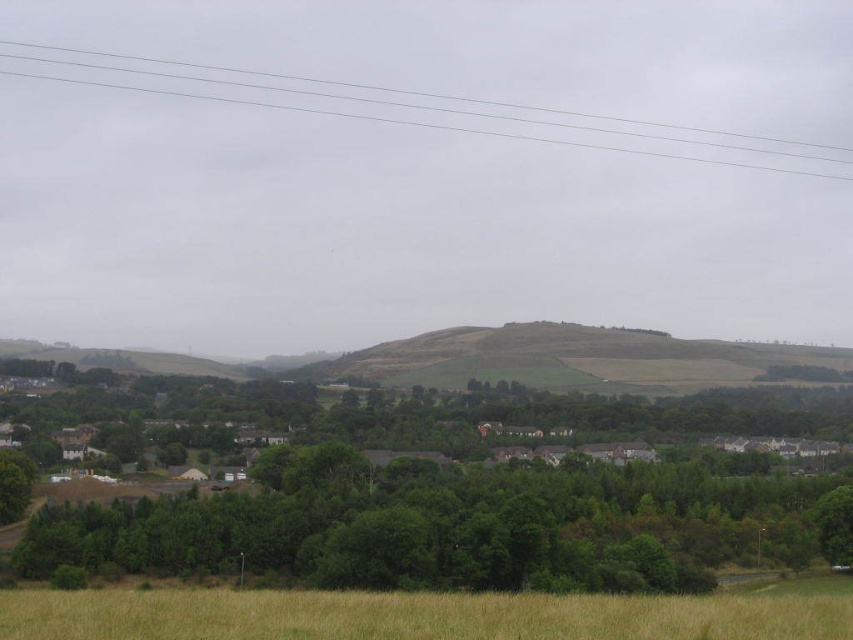
Between green leafy tree at lower center and clear plastic power lines at upper center, which one appears on the right side from the viewer's perspective?

Positioned to the right is green leafy tree at lower center.

Is green leafy tree at lower center to the right of clear plastic power lines at upper center from the viewer's perspective?

Correct, you'll find green leafy tree at lower center to the right of clear plastic power lines at upper center.

Which is in front, point (633, 490) or point (622, 122)?

Point (633, 490) is in front.

Find the location of `green leafy tree at lower center`. green leafy tree at lower center is located at coordinates (453, 529).

Is green leafy tree at lower center smaller than brown grassy field at lower center?

Actually, green leafy tree at lower center might be larger than brown grassy field at lower center.

Looking at this image, is green leafy tree at lower center shorter than brown grassy field at lower center?

No.

Between point (126, 566) and point (496, 616), which one is positioned behind?

The point (126, 566) is more distant.

Find the location of `green leafy tree at lower center`. green leafy tree at lower center is located at coordinates (453, 529).

Can you confirm if brown grassy field at lower center is positioned to the left of clear plastic power lines at upper center?

No, brown grassy field at lower center is not to the left of clear plastic power lines at upper center.

Does point (252, 593) come behind point (788, 168)?

No, it is in front of (788, 168).

At what (x,y) coordinates should I click in order to perform the action: click on brown grassy field at lower center. Please return your answer as a coordinate pair (x, y). The width and height of the screenshot is (853, 640). Looking at the image, I should click on point(415,616).